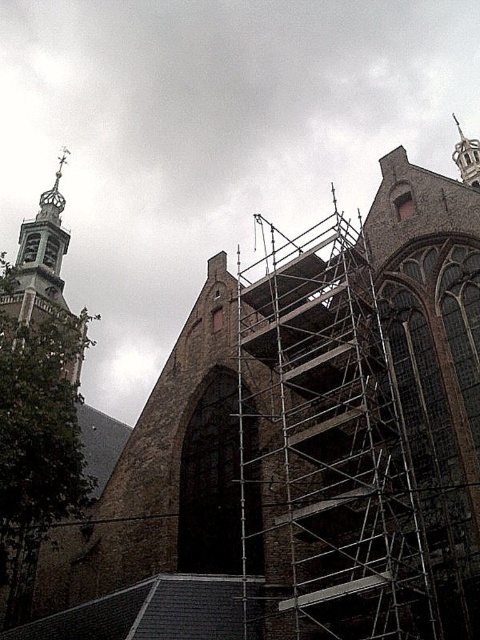
Is point (389, 627) less distant than point (31, 237)?

That is True.

Between point (263, 333) and point (79, 364), which one is positioned behind?

Positioned behind is point (79, 364).

This screenshot has width=480, height=640. What are the coordinates of `silver metallic scaffolding at center` in the screenshot? It's located at (x=326, y=444).